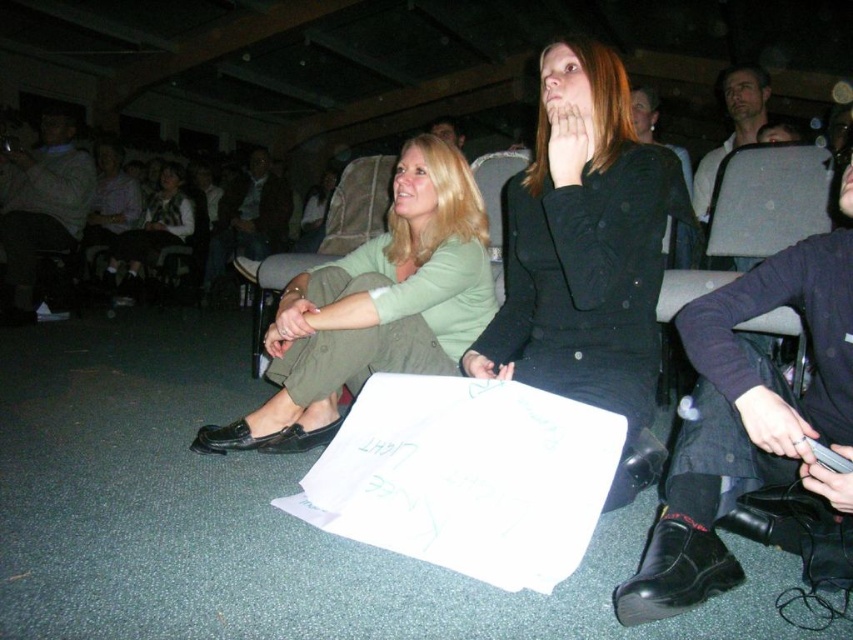
Based on the scene description, where is the green matte shirt at center located in relation to the light brown leather jacket at upper left?

The green matte shirt at center is to the right of the light brown leather jacket at upper left.

You are organizing a photo shoot and need to ensure that all clothing items in the image are correctly labeled. Which clothing item is smaller in size between the green matte shirt at center and the light brown leather jacket at upper left?

The green matte shirt at center is smaller than the light brown leather jacket at upper left according to the description.